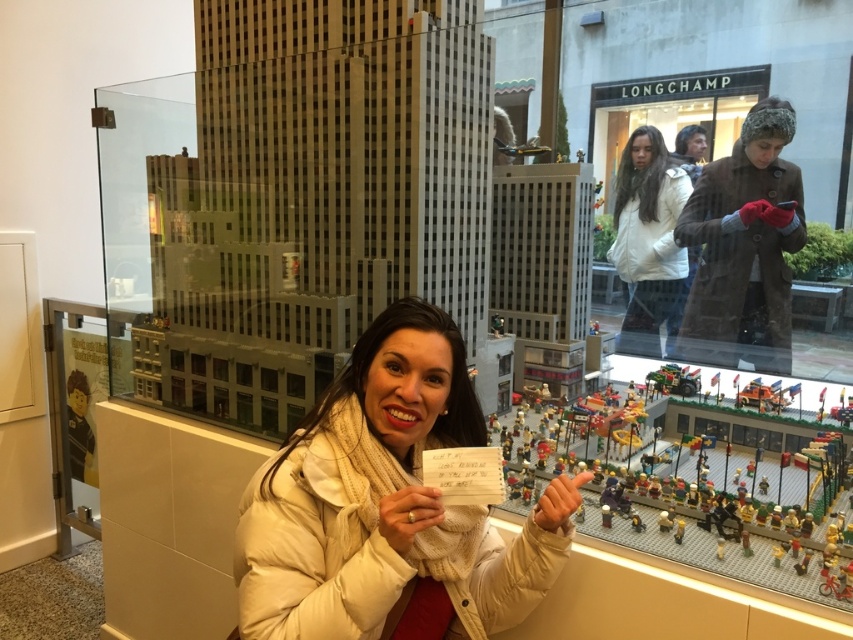
Based on the photo, you are a customer in the LEGO store and want to locate the white matte jacket at upper center. According to the store map, the jacket is at coordinates 0.378, 0.762. If you are standing at the origin point, which direction should you move to reach it?

The white matte jacket at upper center is located at coordinates (x=648, y=241). Since the y coordinate is higher than 0.5, you should move upwards. The x coordinate is 0.378, which is to the left of the center point. Therefore, you should move diagonally to the left and upwards to reach the white matte jacket at upper center.

You are a customer in the LEGO store and want to place a small LEGO figure between the white matte jacket at upper center and the green plastic car at center. How far apart are these two objects to ensure the figure can fit comfortably?

The white matte jacket at upper center is 38.32 inches from the green plastic car at center, so placing a small LEGO figure between them would be feasible as there is sufficient space.

You are a customer in the LEGO store and see both the white puffy coat at center and the white matte jacket at upper center. Which one is positioned to the left of the other?

The white puffy coat at center is positioned to the left of the white matte jacket at upper center.